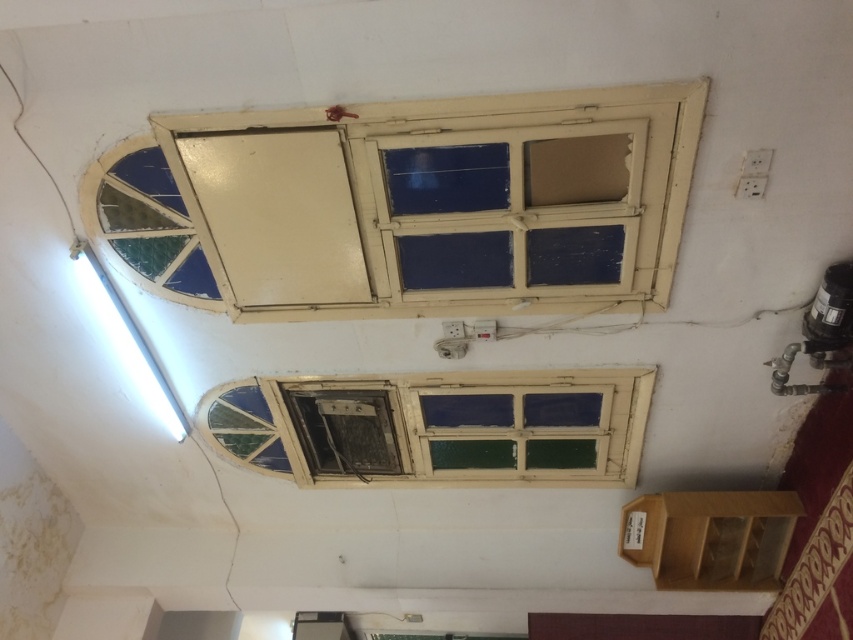
Question: Is matte cream window frame at upper center bigger than wooden window frame at center?

Choices:
 (A) yes
 (B) no

Answer: (A)

Question: Which point is closer to the camera?

Choices:
 (A) (273, 230)
 (B) (558, 392)

Answer: (A)

Question: Among these objects, which one is nearest to the camera?

Choices:
 (A) wooden window frame at center
 (B) matte cream window frame at upper center

Answer: (B)

Question: Which point is closer to the camera?

Choices:
 (A) (415, 188)
 (B) (563, 388)

Answer: (A)

Question: Does matte cream window frame at upper center have a larger size compared to wooden window frame at center?

Choices:
 (A) no
 (B) yes

Answer: (B)

Question: Does matte cream window frame at upper center appear over wooden window frame at center?

Choices:
 (A) no
 (B) yes

Answer: (B)